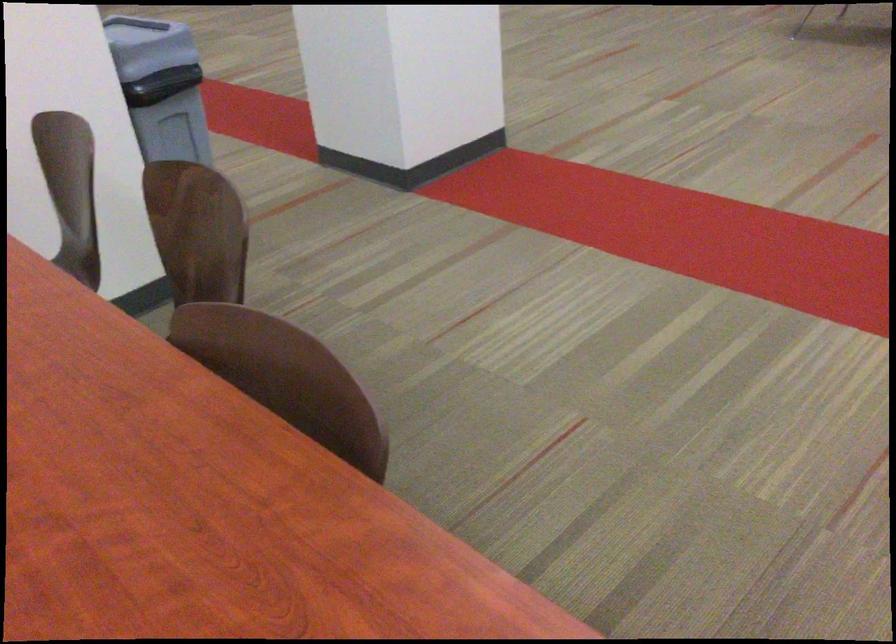
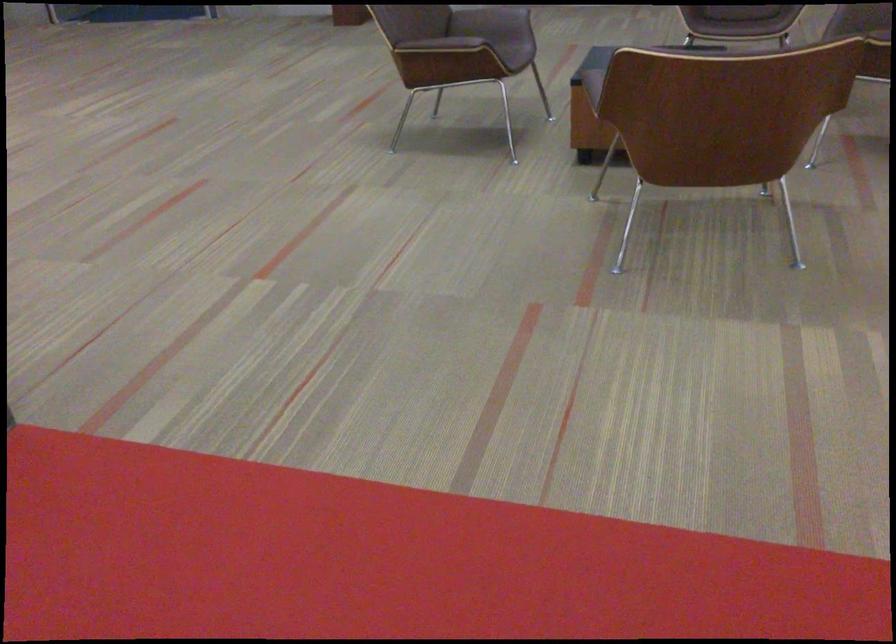
The images are taken continuously from a first-person perspective. In which direction are you moving?

The cameraman walked toward right, forward.